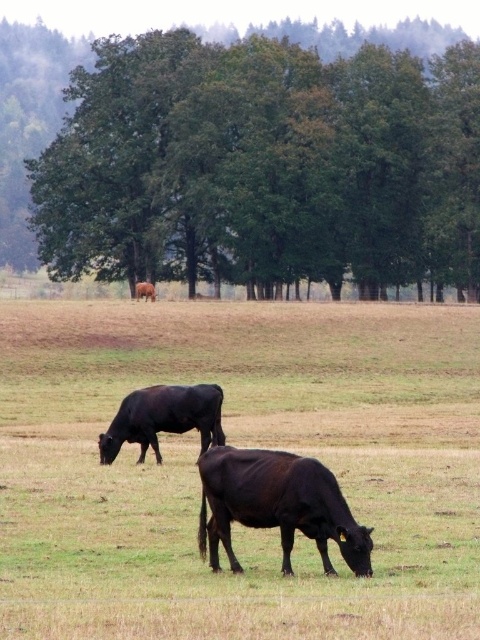
Who is shorter, brown smooth cow at center or green leafy tree at center?

brown smooth cow at center

This screenshot has height=640, width=480. What do you see at coordinates (240, 445) in the screenshot?
I see `brown smooth cow at center` at bounding box center [240, 445].

Between point (250, 582) and point (144, 148), which one is positioned behind?

Point (144, 148)

Locate an element on the screen. This screenshot has width=480, height=640. brown smooth cow at center is located at coordinates (240, 445).

Can you confirm if brown smooth cow at center is taller than shiny black bull at lower center?

Correct, brown smooth cow at center is much taller as shiny black bull at lower center.

Between point (91, 308) and point (156, 448), which one is positioned in front?

Positioned in front is point (156, 448).

Between point (387, 582) and point (189, 404), which one is positioned behind?

Point (189, 404)

Image resolution: width=480 pixels, height=640 pixels. In order to click on brown smooth cow at center in this screenshot , I will do `click(240, 445)`.

Between green leafy tree at center and brown matte cow at center, which one is positioned lower?

brown matte cow at center is below.

Is point (429, 202) farther from viewer compared to point (147, 289)?

Yes, point (429, 202) is behind point (147, 289).

Where is `green leafy tree at center`? green leafy tree at center is located at coordinates (263, 166).